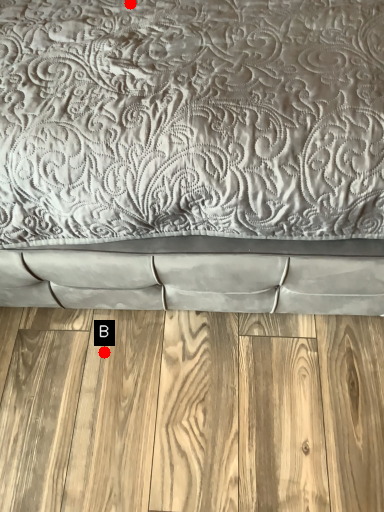
Question: Two points are circled on the image, labeled by A and B beside each circle. Which point is closer to the camera?

Choices:
 (A) A is closer
 (B) B is closer

Answer: (A)